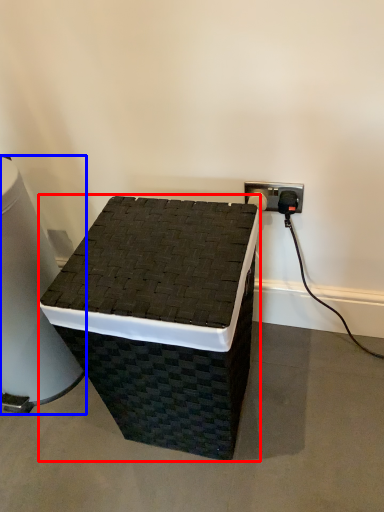
Question: Which object appears farthest to the camera in this image, furniture (highlighted by a red box) or water cooler (highlighted by a blue box)?

Choices:
 (A) furniture
 (B) water cooler

Answer: (B)